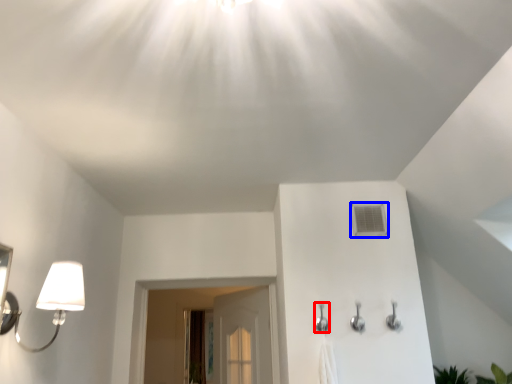
Question: Which object is further to the camera taking this photo, shower (highlighted by a red box) or air conditioner (highlighted by a blue box)?

Choices:
 (A) shower
 (B) air conditioner

Answer: (B)